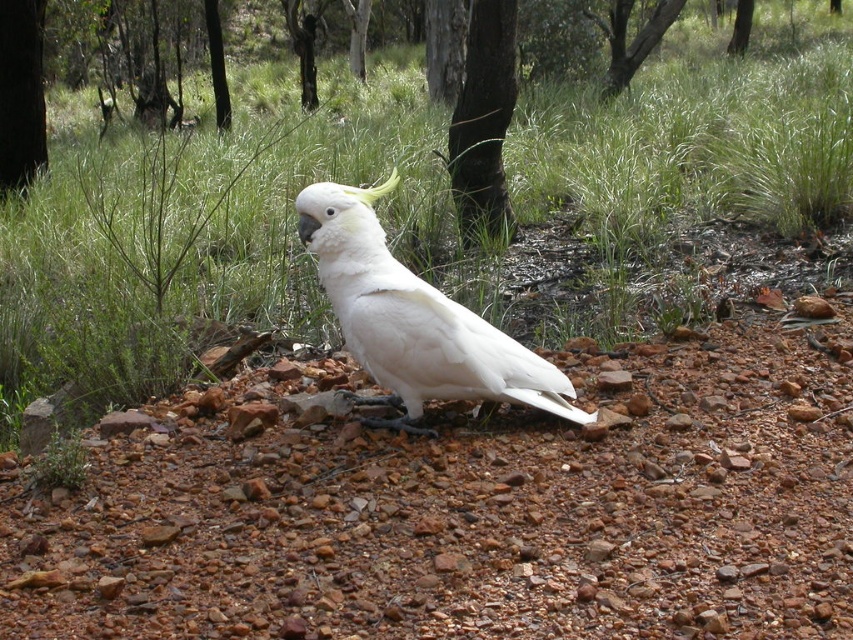
Question: Is green grass at center below green smooth tree at upper center?

Choices:
 (A) no
 (B) yes

Answer: (B)

Question: Which object is the farthest from the white feathered parrot at center?

Choices:
 (A) green leafy tree at upper center
 (B) dark brown bark at left
 (C) green smooth tree at upper center
 (D) brown gravel at center

Answer: (A)

Question: Which of the following is the farthest from the observer?

Choices:
 (A) click(x=624, y=134)
 (B) click(x=222, y=129)

Answer: (B)

Question: Is brown gravel at center closer to the viewer compared to green grass at center?

Choices:
 (A) yes
 (B) no

Answer: (A)

Question: Estimate the real-world distances between objects in this image. Which object is farther from the green grass at center?

Choices:
 (A) smooth bark tree at center
 (B) dark brown bark at left
 (C) green smooth tree at upper center
 (D) brown gravel at center

Answer: (C)

Question: Is brown gravel at center positioned behind smooth bark tree at center?

Choices:
 (A) no
 (B) yes

Answer: (A)